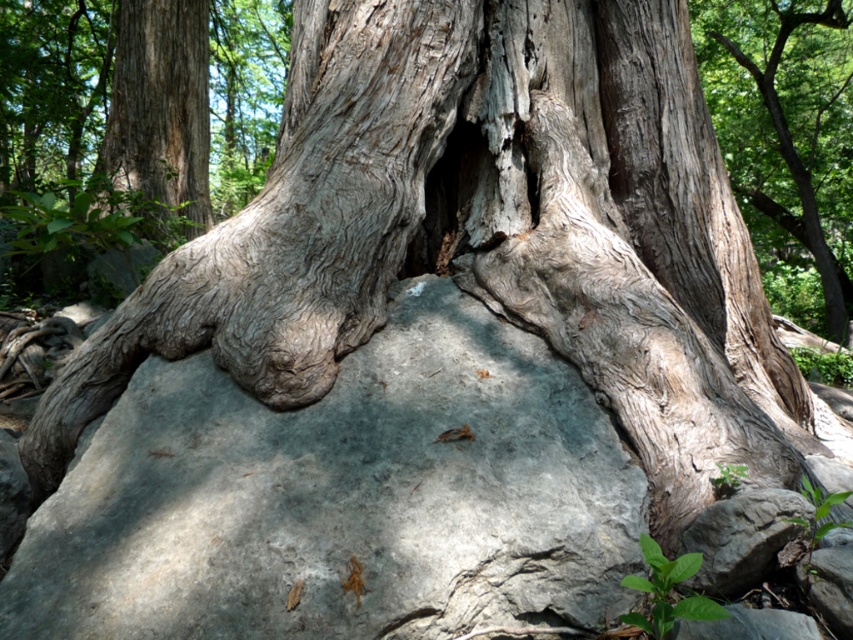
Is smooth gray bark at center above gray rough rock at lower right?

Yes.

Which is more to the right, smooth gray bark at center or gray rough rock at lower right?

Positioned to the right is smooth gray bark at center.

The height and width of the screenshot is (640, 853). I want to click on smooth gray bark at center, so click(x=787, y=122).

Locate an element on the screen. This screenshot has height=640, width=853. smooth gray bark at center is located at coordinates (787, 122).

Based on the photo, how distant is smooth gray bark at upper left from gray rough rock at lower right?

smooth gray bark at upper left is 5.44 meters away from gray rough rock at lower right.

Which is below, smooth gray bark at upper left or gray rough rock at lower right?

gray rough rock at lower right

Does point (109, 132) come in front of point (729, 508)?

No, (109, 132) is further to viewer.

Locate an element on the screen. Image resolution: width=853 pixels, height=640 pixels. smooth gray bark at upper left is located at coordinates (161, 108).

Is gray/rough rock at center to the left of smooth gray bark at center from the viewer's perspective?

Correct, you'll find gray/rough rock at center to the left of smooth gray bark at center.

Describe the element at coordinates (341, 497) in the screenshot. I see `gray/rough rock at center` at that location.

The width and height of the screenshot is (853, 640). What are the coordinates of `gray/rough rock at center` in the screenshot? It's located at (341, 497).